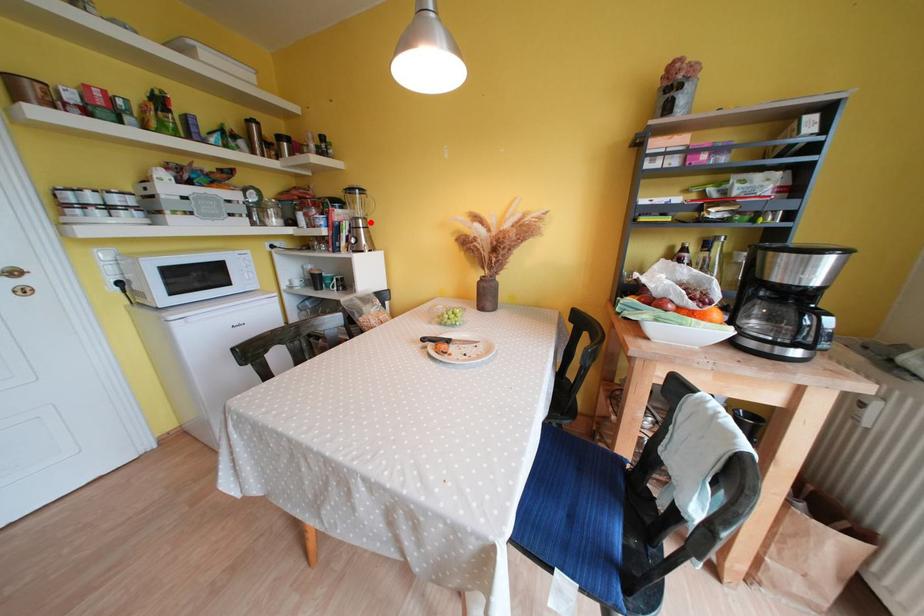
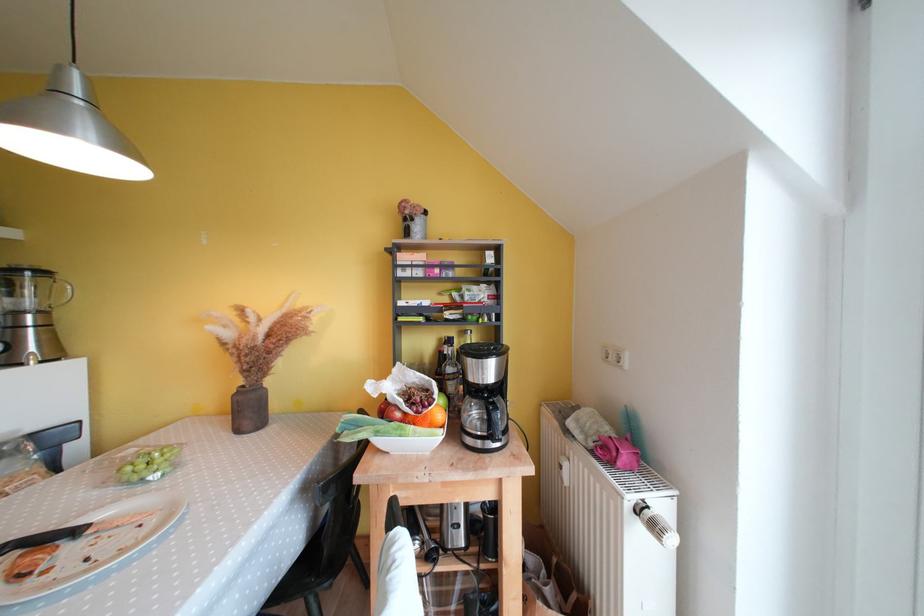
Find the pixel in the second image that matches the highlighted location in the first image.

(49, 315)